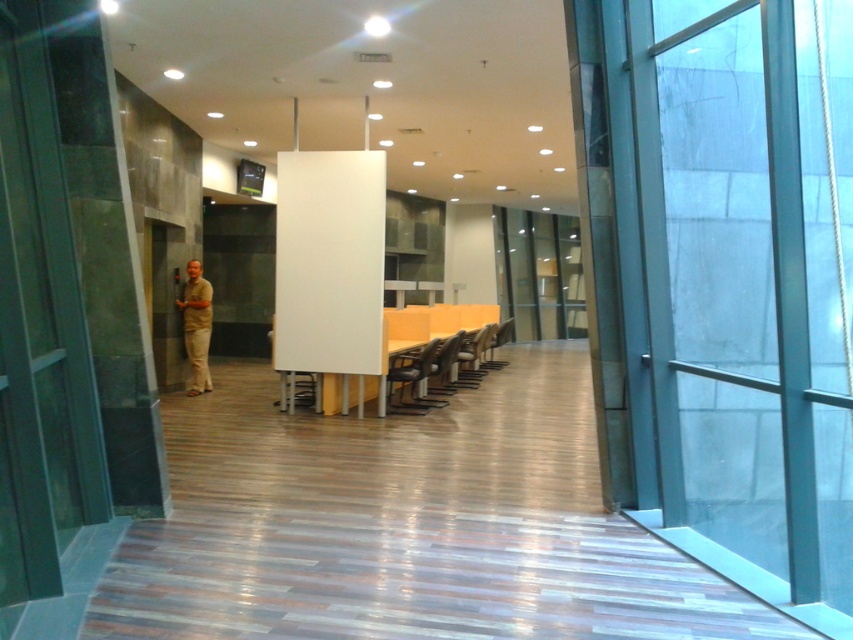
You are standing in the office area and need to reach the elevator. There are two points marked on the floor at coordinates point (207, 376) and point (355, 401). Which point is closer to the elevator?

Point (355, 401) is closer to the elevator because it is in front of point (207, 376), which is behind it.

You are standing at the entrance of the office and need to sit down. There is a matte gray chair at center. Can you walk straight from the entrance to reach it without needing to turn?

The position of matte gray chair at center is at point (x=469, y=356). Since the chair is centrally located in the office space, walking straight from the entrance should allow you to reach it without needing to turn.